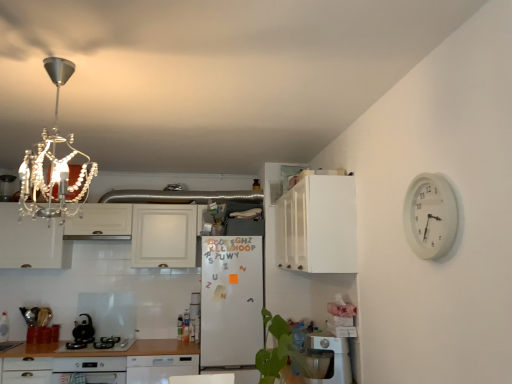
Question: Does point (x=210, y=246) appear closer or farther from the camera than point (x=152, y=357)?

Choices:
 (A) closer
 (B) farther

Answer: (B)

Question: In the image, is white matte refrigerator at center positioned in front of or behind white glossy dishwasher at lower center, the first dish washer when ordered from bottom to top?

Choices:
 (A) behind
 (B) front

Answer: (A)

Question: Estimate the real-world distances between objects in this image. Which object is farther from the black matte kettle at lower left?

Choices:
 (A) white glossy dishwasher at lower center, acting as the 2th dish washer starting from the front
 (B) white matte refrigerator at center
 (C) white glossy cabinet at upper left, arranged as the second cabinetry when viewed from the front
 (D) white matte cabinet at upper center, which ranks as the 2th cabinetry in back-to-front order
 (E) white plastic dish washer at lower center, the 2th dish washer from the left

Answer: (D)

Question: Estimate the real-world distances between objects in this image. Which object is farther from the black matte kettle at lower left?

Choices:
 (A) white matte cabinet at upper center, arranged as the second cabinetry when viewed from the left
 (B) black glass cooktop at lower left
 (C) white matte refrigerator at center
 (D) white plastic dish washer at lower center, which is the first dish washer from right to left
 (E) white plastic clock at upper right

Answer: (E)